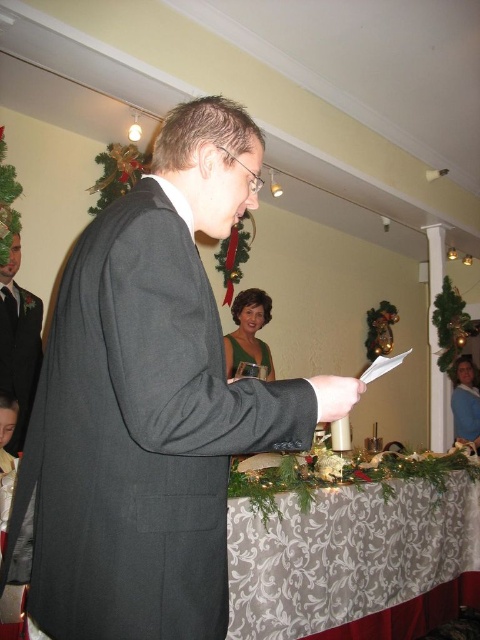
Does green satin dress at center appear on the left side of green velvet dress at center?

Correct, you'll find green satin dress at center to the left of green velvet dress at center.

Does point (269, 300) come farther from viewer compared to point (470, 371)?

No, (269, 300) is closer to viewer.

Identify the location of green satin dress at center. Image resolution: width=480 pixels, height=640 pixels. (249, 332).

Who is positioned more to the right, white damask tablecloth at lower center or green satin dress at center?

From the viewer's perspective, white damask tablecloth at lower center appears more on the right side.

Based on the photo, is white damask tablecloth at lower center bigger than green satin dress at center?

Correct, white damask tablecloth at lower center is larger in size than green satin dress at center.

Is point (287, 529) positioned after point (245, 324)?

That is False.

Identify the location of white damask tablecloth at lower center. (351, 547).

Does dark gray suit at center appear under green velvet dress at center?

No.

Does dark gray suit at center lie behind green velvet dress at center?

No.

Who is more distant from viewer, (x=210, y=211) or (x=470, y=404)?

Positioned behind is point (x=470, y=404).

Image resolution: width=480 pixels, height=640 pixels. Find the location of `dark gray suit at center`. dark gray suit at center is located at coordinates (149, 404).